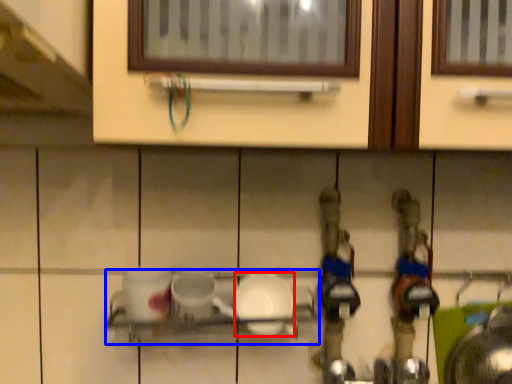
Question: Which object is closer to the camera taking this photo, tableware (highlighted by a red box) or shelf (highlighted by a blue box)?

Choices:
 (A) tableware
 (B) shelf

Answer: (B)